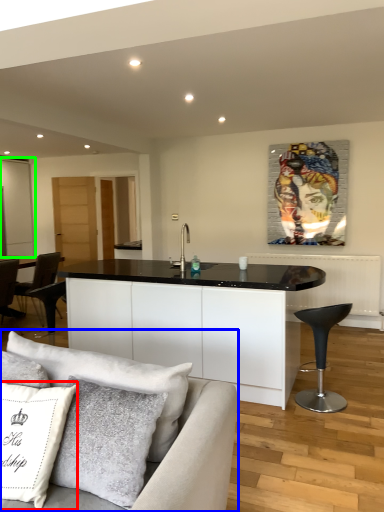
Question: Which object is positioned closest to pillow (highlighted by a red box)? Select from studio couch (highlighted by a blue box) and glass door (highlighted by a green box).

Choices:
 (A) studio couch
 (B) glass door

Answer: (A)